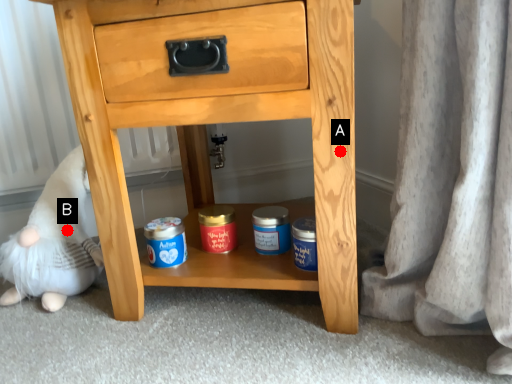
Question: Two points are circled on the image, labeled by A and B beside each circle. Which point is closer to the camera?

Choices:
 (A) A is closer
 (B) B is closer

Answer: (A)